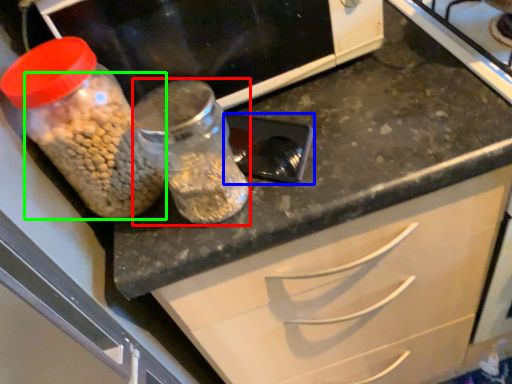
Question: Which object is the farthest from glass jar (highlighted by a red box)? Choose among these: appliance (highlighted by a blue box) or food (highlighted by a green box).

Choices:
 (A) appliance
 (B) food

Answer: (A)